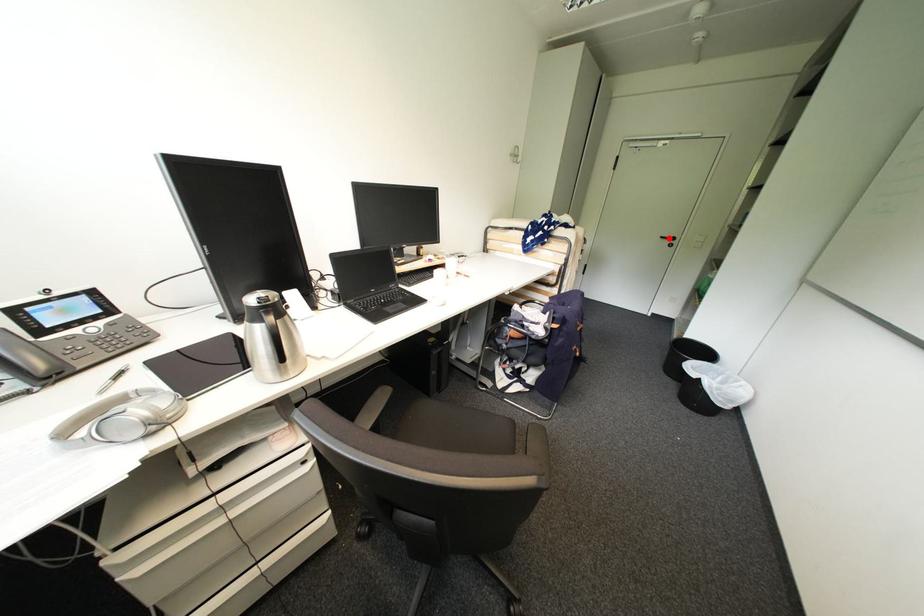
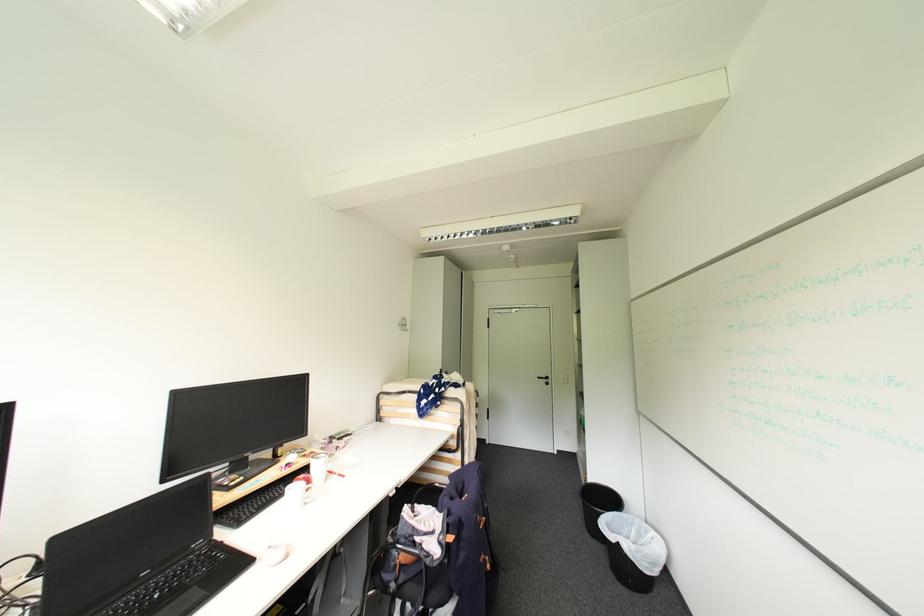
Where in the second image is the point corresponding to the highlighted location from the first image?

(544, 379)